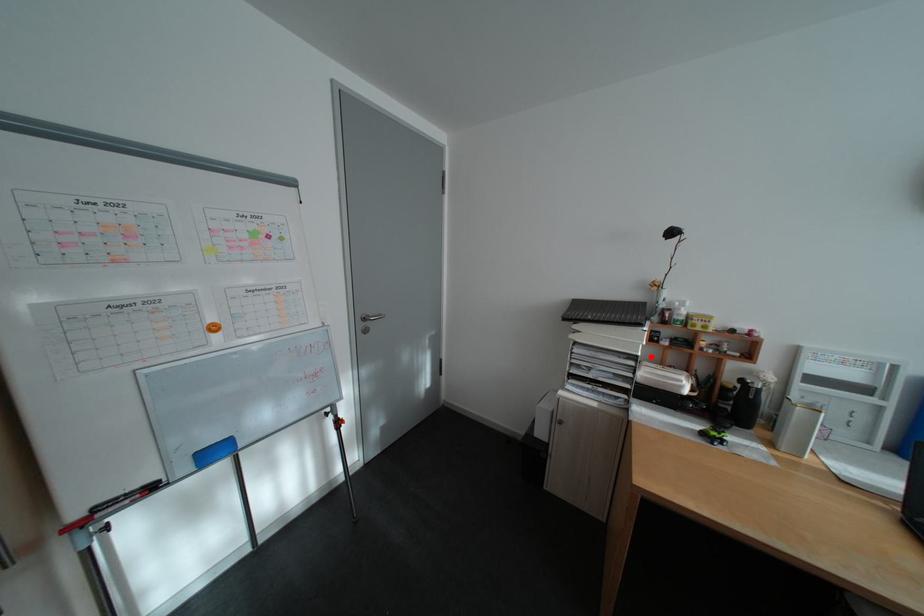
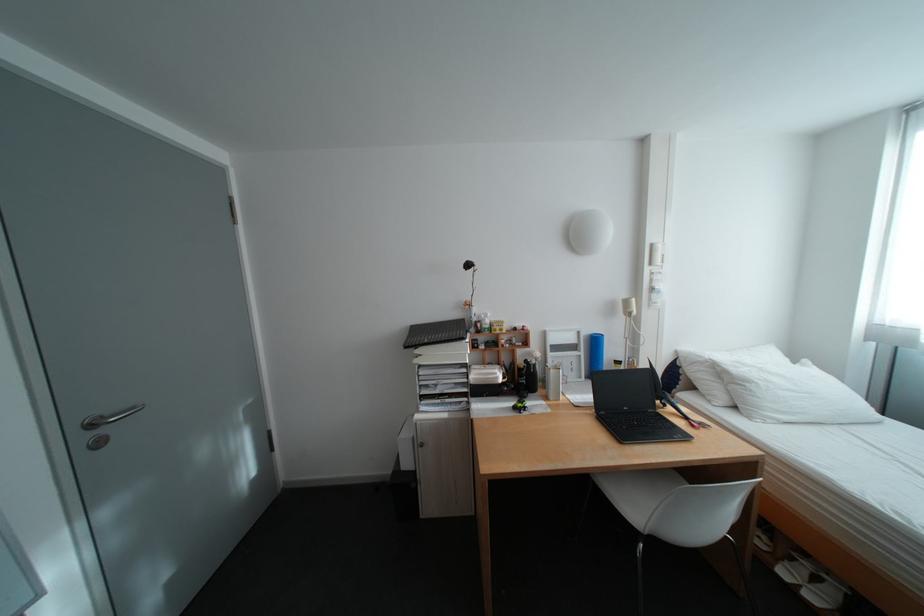
Find the pixel in the second image that matches the highlighted location in the first image.

(480, 363)